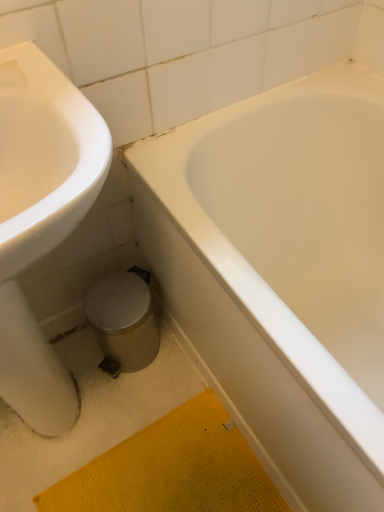
Question: Is white glossy bathtub at center placed right next to yellow textured bath mat at lower center?

Choices:
 (A) yes
 (B) no

Answer: (B)

Question: Can you confirm if white glossy bathtub at center is wider than yellow textured bath mat at lower center?

Choices:
 (A) no
 (B) yes

Answer: (B)

Question: Is white glossy bathtub at center thinner than yellow textured bath mat at lower center?

Choices:
 (A) yes
 (B) no

Answer: (B)

Question: Considering the relative sizes of white glossy bathtub at center and yellow textured bath mat at lower center in the image provided, is white glossy bathtub at center bigger than yellow textured bath mat at lower center?

Choices:
 (A) yes
 (B) no

Answer: (A)

Question: Is white glossy bathtub at center taller than yellow textured bath mat at lower center?

Choices:
 (A) yes
 (B) no

Answer: (A)

Question: In terms of height, does white glossy sink at left look taller or shorter compared to white glossy bathtub at center?

Choices:
 (A) short
 (B) tall

Answer: (B)

Question: Is white glossy sink at left to the left or to the right of white glossy bathtub at center in the image?

Choices:
 (A) right
 (B) left

Answer: (B)

Question: From the image's perspective, is white glossy sink at left located above or below white glossy bathtub at center?

Choices:
 (A) above
 (B) below

Answer: (B)

Question: Choose the correct answer: Is white glossy sink at left inside white glossy bathtub at center or outside it?

Choices:
 (A) outside
 (B) inside

Answer: (A)

Question: Choose the correct answer: Is white glossy sink at left inside yellow textured bath mat at lower center or outside it?

Choices:
 (A) outside
 (B) inside

Answer: (A)

Question: From a real-world perspective, is white glossy sink at left positioned above or below yellow textured bath mat at lower center?

Choices:
 (A) below
 (B) above

Answer: (B)

Question: Is white glossy sink at left wider or thinner than yellow textured bath mat at lower center?

Choices:
 (A) wide
 (B) thin

Answer: (B)

Question: From their relative heights in the image, would you say white glossy sink at left is taller or shorter than yellow textured bath mat at lower center?

Choices:
 (A) short
 (B) tall

Answer: (B)

Question: Considering the positions of white glossy bathtub at center and yellow textured bath mat at lower center in the image, is white glossy bathtub at center taller or shorter than yellow textured bath mat at lower center?

Choices:
 (A) short
 (B) tall

Answer: (B)

Question: Is white glossy bathtub at center bigger or smaller than yellow textured bath mat at lower center?

Choices:
 (A) big
 (B) small

Answer: (A)